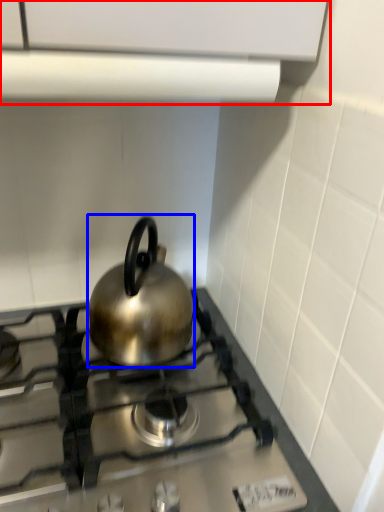
Question: Which of the following is the closest to the observer, vent (highlighted by a red box) or kettle (highlighted by a blue box)?

Choices:
 (A) vent
 (B) kettle

Answer: (A)